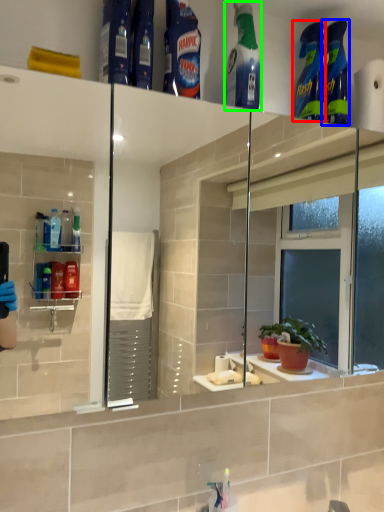
Question: Based on their relative distances, which object is farther from cleaning product (highlighted by a red box)? Choose from cleaning product (highlighted by a blue box) and cleaning product (highlighted by a green box).

Choices:
 (A) cleaning product
 (B) cleaning product

Answer: (B)